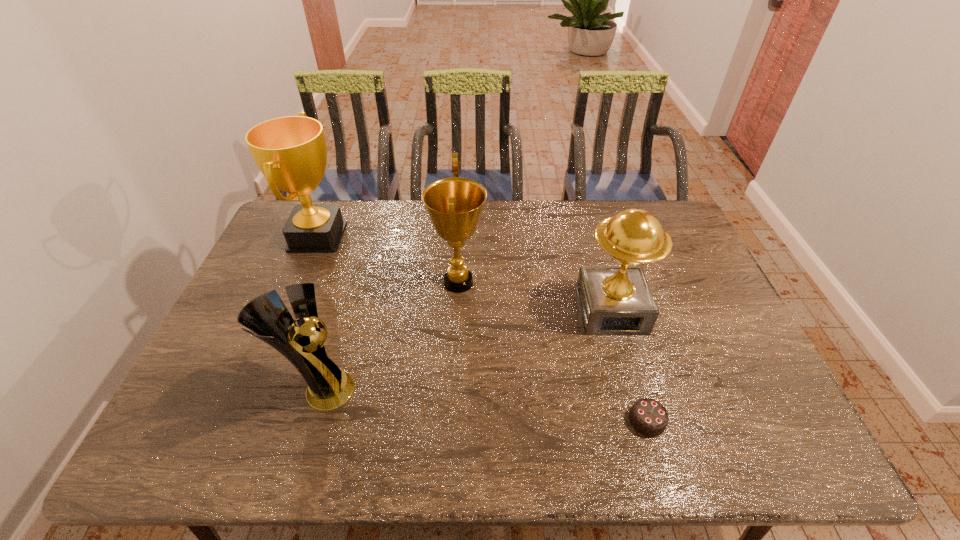
Where is `the third object from right to left`? The width and height of the screenshot is (960, 540). the third object from right to left is located at coordinates (454, 205).

At what (x,y) coordinates should I click in order to perform the action: click on the rightmost award. Please return your answer as a coordinate pair (x, y). Image resolution: width=960 pixels, height=540 pixels. Looking at the image, I should click on (614, 300).

This screenshot has height=540, width=960. I want to click on the nearest award, so click(x=329, y=387).

Locate an element on the screen. chocolate cake is located at coordinates (647, 416).

What are the coordinates of `vacant area situated 0.080m on the front view with handles of the third object from right to left` in the screenshot? It's located at (512, 282).

This screenshot has width=960, height=540. Find the location of `vacant space located on the front-facing side of the rightmost award`. vacant space located on the front-facing side of the rightmost award is located at coordinates (638, 406).

Where is `blank space located 0.320m at the front of the nearest award, where the globe is visible`? The image size is (960, 540). blank space located 0.320m at the front of the nearest award, where the globe is visible is located at coordinates (484, 390).

Where is `free space located 0.160m on the back of the shortest object`? free space located 0.160m on the back of the shortest object is located at coordinates (626, 350).

Locate an element on the screen. object located in the far edge section of the desktop is located at coordinates 291,152.

Find the location of a particular element. Image resolution: width=960 pixels, height=540 pixels. award present at the near edge is located at coordinates (329, 387).